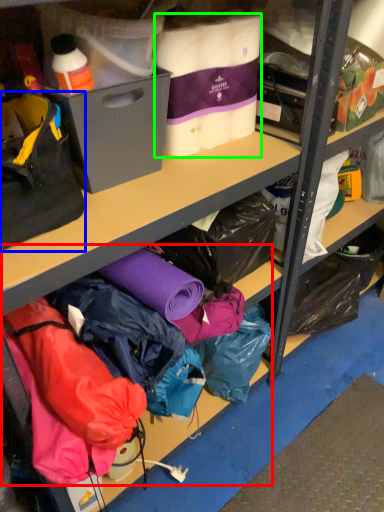
Question: Based on their relative distances, which object is farther from clothing (highlighted by a red box)? Choose from handbag (highlighted by a blue box) and clothing (highlighted by a green box).

Choices:
 (A) handbag
 (B) clothing

Answer: (B)